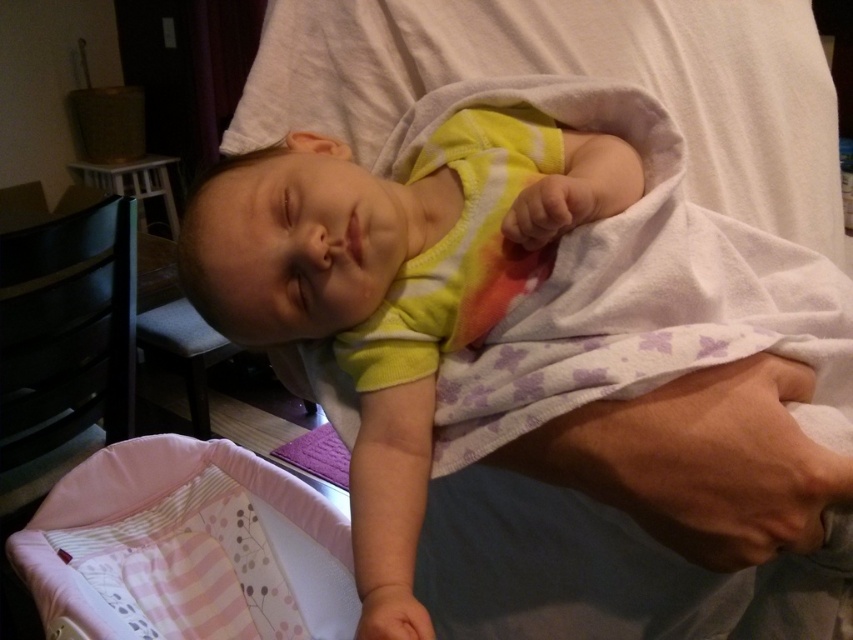
Question: Does yellow cotton onesie at center appear under pink fabric infant bed at lower left?

Choices:
 (A) no
 (B) yes

Answer: (A)

Question: Which point is closer to the camera?

Choices:
 (A) (621, 604)
 (B) (300, 563)

Answer: (A)

Question: Is yellow cotton onesie at center thinner than pink fabric infant bed at lower left?

Choices:
 (A) no
 (B) yes

Answer: (B)

Question: Which of the following is the farthest from the observer?

Choices:
 (A) yellow cotton onesie at center
 (B) pink fabric infant bed at lower left

Answer: (B)

Question: Is yellow cotton onesie at center above pink fabric infant bed at lower left?

Choices:
 (A) no
 (B) yes

Answer: (B)